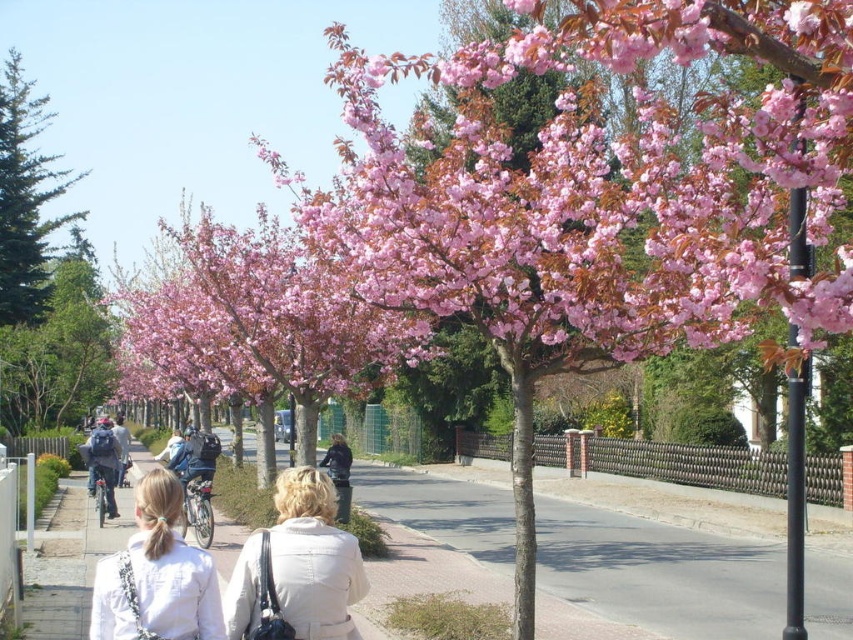
The height and width of the screenshot is (640, 853). Describe the element at coordinates (296, 568) in the screenshot. I see `beige fabric coat at center` at that location.

Can you confirm if beige fabric coat at center is positioned below white fabric jacket at lower center?

Yes.

Find the location of a particular element. This screenshot has width=853, height=640. beige fabric coat at center is located at coordinates (296, 568).

Can you confirm if white fabric jacket at lower center is positioned to the right of green evergreen tree at left?

Correct, you'll find white fabric jacket at lower center to the right of green evergreen tree at left.

Where is `white fabric jacket at lower center`? The height and width of the screenshot is (640, 853). white fabric jacket at lower center is located at coordinates (155, 576).

Measure the distance between white fabric jacket at lower center and camera.

The distance of white fabric jacket at lower center from camera is 5.10 meters.

Where is `white fabric jacket at lower center`? This screenshot has width=853, height=640. white fabric jacket at lower center is located at coordinates (155, 576).

Consider the image. Between beige fabric coat at center and green evergreen tree at left, which one has less height?

beige fabric coat at center

Between beige fabric coat at center and green evergreen tree at left, which one is positioned lower?

beige fabric coat at center is lower down.

Between point (329, 557) and point (26, 216), which one is positioned in front?

Point (329, 557) is more forward.

At what (x,y) coordinates should I click in order to perform the action: click on beige fabric coat at center. Please return your answer as a coordinate pair (x, y). This screenshot has height=640, width=853. Looking at the image, I should click on (296, 568).